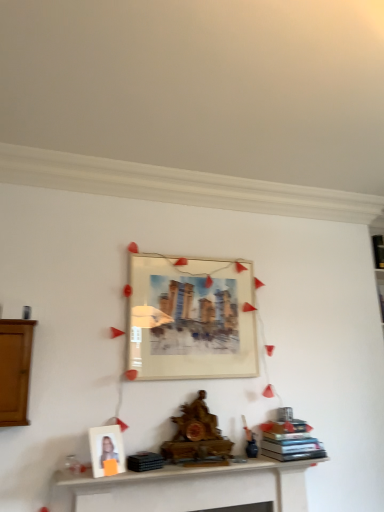
Question: In which direction should I rotate to look at matte white picture frame at center, the second picture frame when ordered from front to back?

Choices:
 (A) left
 (B) right

Answer: (B)

Question: Is wooden statue at center at the right side of white matte picture frame at lower left, which appears as the 2th picture frame when viewed from the top?

Choices:
 (A) no
 (B) yes

Answer: (B)

Question: Can you confirm if wooden statue at center is bigger than white matte picture frame at lower left, arranged as the first picture frame when ordered from the bottom?

Choices:
 (A) no
 (B) yes

Answer: (B)

Question: From a real-world perspective, is wooden statue at center under white matte picture frame at lower left, which ranks as the 2th picture frame in back-to-front order?

Choices:
 (A) no
 (B) yes

Answer: (A)

Question: From a real-world perspective, is wooden statue at center on top of white matte picture frame at lower left, acting as the 1th picture frame starting from the front?

Choices:
 (A) no
 (B) yes

Answer: (B)

Question: Is wooden statue at center directly adjacent to white matte picture frame at lower left, which appears as the 2th picture frame when viewed from the top?

Choices:
 (A) no
 (B) yes

Answer: (A)

Question: Is wooden statue at center facing towards white matte picture frame at lower left, which ranks as the 2th picture frame in back-to-front order?

Choices:
 (A) no
 (B) yes

Answer: (A)

Question: Considering the relative sizes of white matte picture frame at lower left, the second picture frame viewed from the right, and white wooden shelf at lower center in the image provided, is white matte picture frame at lower left, the second picture frame viewed from the right, thinner than white wooden shelf at lower center?

Choices:
 (A) no
 (B) yes

Answer: (B)

Question: Does white matte picture frame at lower left, the second picture frame viewed from the right, appear on the left side of white wooden shelf at lower center?

Choices:
 (A) no
 (B) yes

Answer: (B)

Question: From the image's perspective, is white matte picture frame at lower left, which appears as the 2th picture frame when viewed from the top, on white wooden shelf at lower center?

Choices:
 (A) no
 (B) yes

Answer: (B)

Question: Is white matte picture frame at lower left, arranged as the first picture frame when ordered from the bottom, bigger than white wooden shelf at lower center?

Choices:
 (A) yes
 (B) no

Answer: (B)

Question: Is white matte picture frame at lower left, acting as the 1th picture frame starting from the front, oriented towards white wooden shelf at lower center?

Choices:
 (A) yes
 (B) no

Answer: (B)

Question: From the image's perspective, is white matte picture frame at lower left, the second picture frame viewed from the right, under white wooden shelf at lower center?

Choices:
 (A) yes
 (B) no

Answer: (B)

Question: From a real-world perspective, is black matte book at upper right, the first book viewed from the back, beneath brown wooden cabinet at left?

Choices:
 (A) no
 (B) yes

Answer: (A)